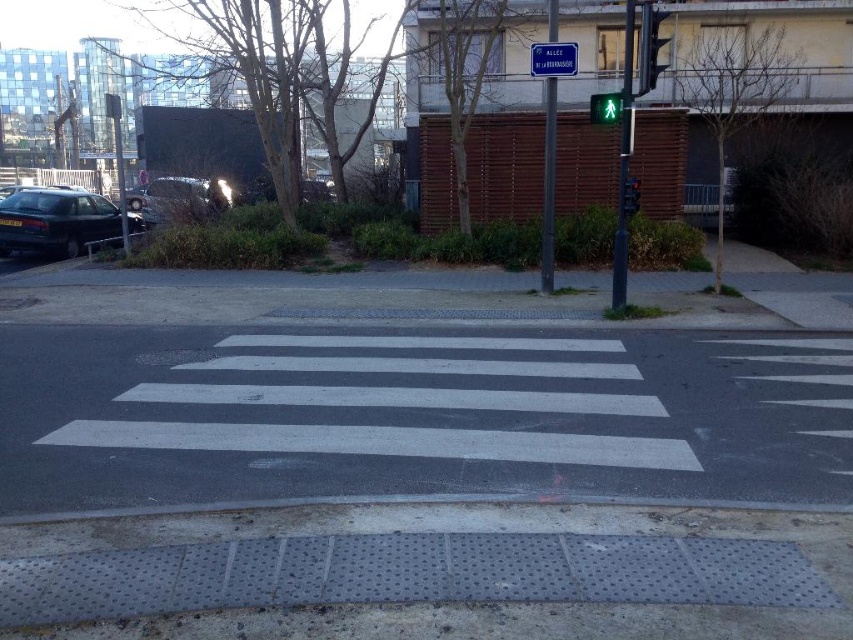
Is white asphalt crosswalk at center in front of metallic traffic light at center right?

Yes, it is in front of metallic traffic light at center right.

Who is more forward, (641, 353) or (635, 208)?

Point (641, 353) is more forward.

This screenshot has height=640, width=853. What are the coordinates of `white asphalt crosswalk at center` in the screenshot? It's located at (408, 422).

Based on the photo, who is shorter, shiny silver car at left or metallic traffic light at center right?

metallic traffic light at center right is shorter.

Describe the element at coordinates (177, 196) in the screenshot. The height and width of the screenshot is (640, 853). I see `shiny silver car at left` at that location.

In order to click on shiny silver car at left in this screenshot , I will do `click(177, 196)`.

Between white asphalt crosswalk at center and metallic traffic light at upper right, which one is positioned higher?

Positioned higher is metallic traffic light at upper right.

Which is below, white asphalt crosswalk at center or metallic traffic light at upper right?

white asphalt crosswalk at center

Where is `white asphalt crosswalk at center`? white asphalt crosswalk at center is located at coordinates (408, 422).

Find the location of a particular element. This screenshot has width=853, height=640. white asphalt crosswalk at center is located at coordinates (408, 422).